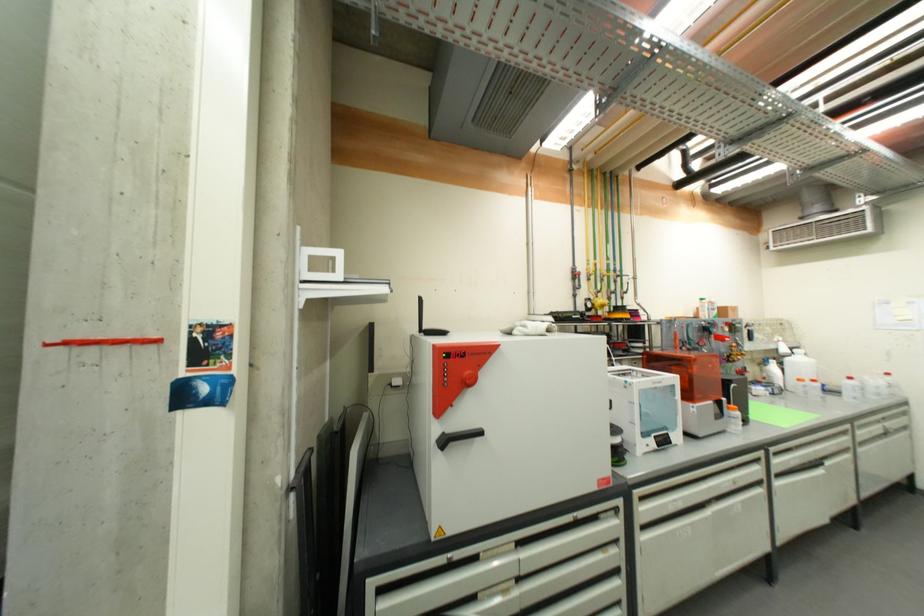
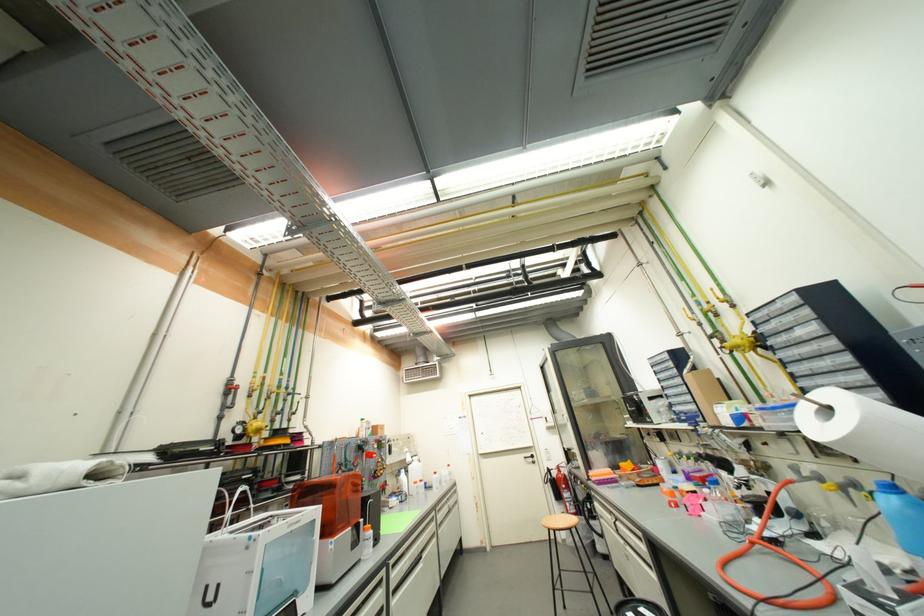
Find the pixel in the second image that matches pixel 864 442 in the first image.

(444, 525)